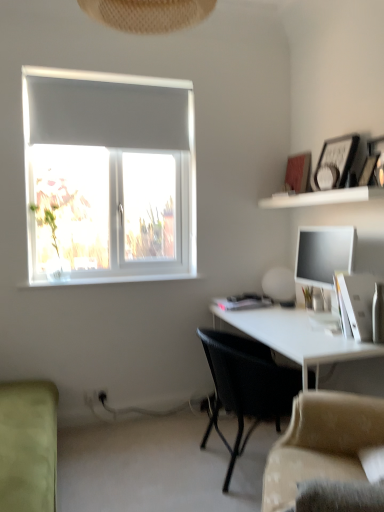
Question: Is white glossy shelf at upper right located outside wooden picture frame at upper right?

Choices:
 (A) no
 (B) yes

Answer: (B)

Question: From a real-world perspective, is white glossy shelf at upper right below wooden picture frame at upper right?

Choices:
 (A) yes
 (B) no

Answer: (A)

Question: Considering the relative sizes of white glossy shelf at upper right and wooden picture frame at upper right in the image provided, is white glossy shelf at upper right shorter than wooden picture frame at upper right?

Choices:
 (A) no
 (B) yes

Answer: (B)

Question: Considering the relative positions of white glossy shelf at upper right and wooden picture frame at upper right in the image provided, is white glossy shelf at upper right to the left of wooden picture frame at upper right from the viewer's perspective?

Choices:
 (A) yes
 (B) no

Answer: (A)

Question: Is wooden picture frame at upper right a part of white glossy shelf at upper right?

Choices:
 (A) yes
 (B) no

Answer: (B)

Question: Is white glossy shelf at upper right in front of wooden picture frame at upper right?

Choices:
 (A) yes
 (B) no

Answer: (A)

Question: Can we say beige fabric couch at lower right, arranged as the first studio couch when viewed from the right, lies outside satin black monitor at right?

Choices:
 (A) no
 (B) yes

Answer: (B)

Question: Is beige fabric couch at lower right, which ranks as the 2th studio couch in left-to-right order, directly adjacent to satin black monitor at right?

Choices:
 (A) yes
 (B) no

Answer: (B)

Question: Can you confirm if beige fabric couch at lower right, which ranks as the 2th studio couch in left-to-right order, is taller than satin black monitor at right?

Choices:
 (A) no
 (B) yes

Answer: (A)

Question: From a real-world perspective, does beige fabric couch at lower right, which ranks as the 2th studio couch in left-to-right order, sit lower than satin black monitor at right?

Choices:
 (A) no
 (B) yes

Answer: (B)

Question: Does beige fabric couch at lower right, which ranks as the 2th studio couch in left-to-right order, turn towards satin black monitor at right?

Choices:
 (A) yes
 (B) no

Answer: (B)

Question: Is beige fabric couch at lower right, arranged as the first studio couch when viewed from the right, looking in the opposite direction of satin black monitor at right?

Choices:
 (A) yes
 (B) no

Answer: (B)

Question: Is black woven chair at center thinner than light green fabric couch at lower left, which is the first studio couch from left to right?

Choices:
 (A) yes
 (B) no

Answer: (B)